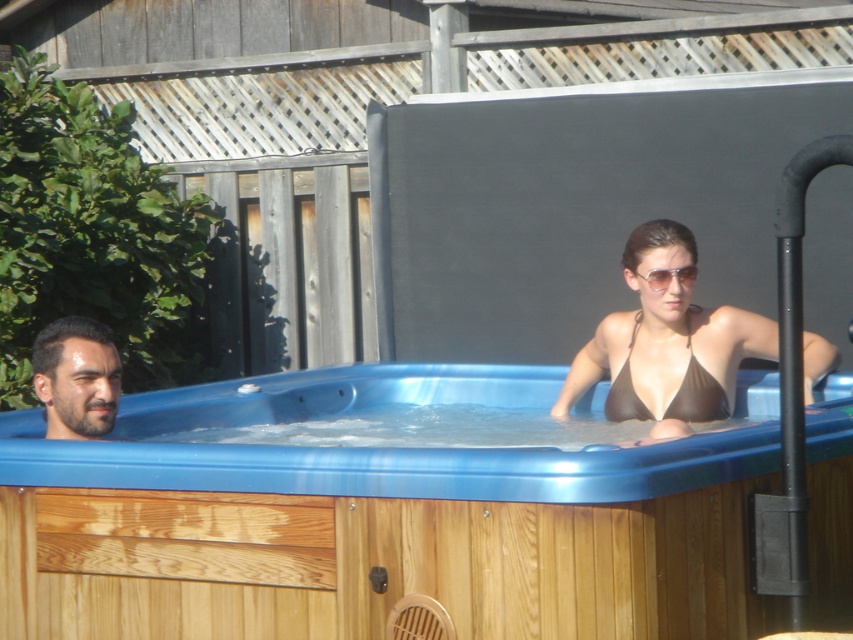
Based on the photo, you are standing at the edge of the hot tub and want to hand a towel to the person wearing the brown matte bikini at upper right. Based on their position coordinates, where should you aim to place the towel?

The brown matte bikini at upper right is located at coordinates point (666, 344), so you should aim to place the towel near that position.

You are a photographer taking a picture of the dark brown hair at left and the brown matte bikini top at center. Based on their positions in the image, which object is closer to the camera?

The dark brown hair at left is below the brown matte bikini top at center, meaning the brown matte bikini top at center is closer to the camera.

You are standing at the point marked by the coordinate point at point (53, 436). You want to throw a beach ball to the person in the brown bikini top and sunglasses who is fully visible above the waterline in the hot tub. Will the beach ball reach them if you throw it with a force that can travel 15 feet?

The distance between you and the person in the brown bikini top and sunglasses is 17.11 feet. Since the throw can only travel 15 feet, the beach ball will not reach them.